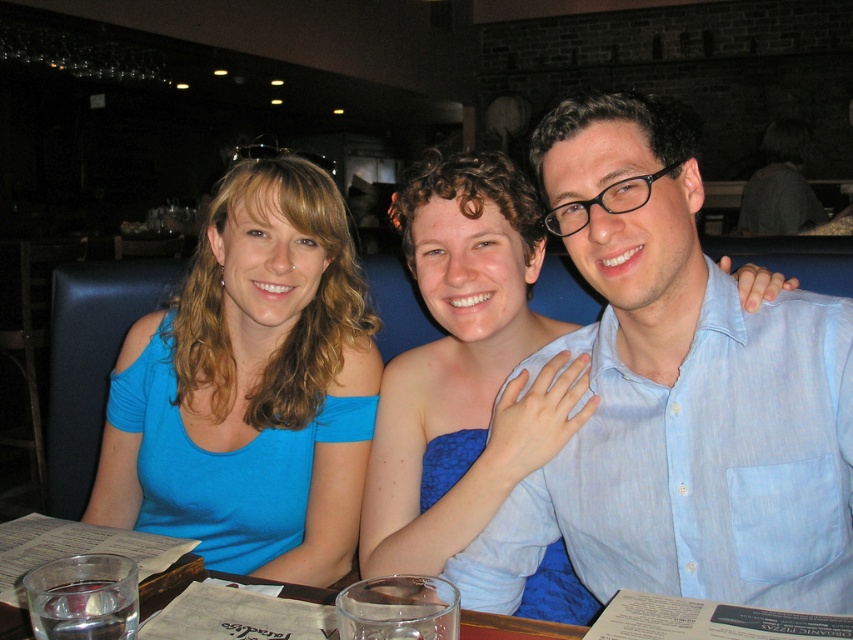
Is point (206, 269) positioned behind point (519, 625)?

Yes, it is.

Does point (102, 509) come closer to viewer compared to point (469, 628)?

No, it is not.

Where is `blue cotton shirt at left`? blue cotton shirt at left is located at coordinates (251, 387).

Does light blue shirt at center have a larger size compared to clear glass water at lower center?

Indeed, light blue shirt at center has a larger size compared to clear glass water at lower center.

Between point (751, 328) and point (68, 545), which one is positioned in front?

Point (751, 328) is in front.

Is point (724, 435) positioned before point (57, 554)?

Yes, point (724, 435) is closer to viewer.

At what (x,y) coordinates should I click in order to perform the action: click on light blue shirt at center. Please return your answer as a coordinate pair (x, y). This screenshot has width=853, height=640. Looking at the image, I should click on (677, 400).

From the picture: Who is shorter, light blue shirt at center or blue cotton shirt at left?

light blue shirt at center is shorter.

Who is more distant from viewer, (769, 326) or (175, 516)?

The point (175, 516) is more distant.

Who is more distant from viewer, (589,147) or (228,460)?

Positioned behind is point (228,460).

Locate an element on the screen. light blue shirt at center is located at coordinates (677, 400).